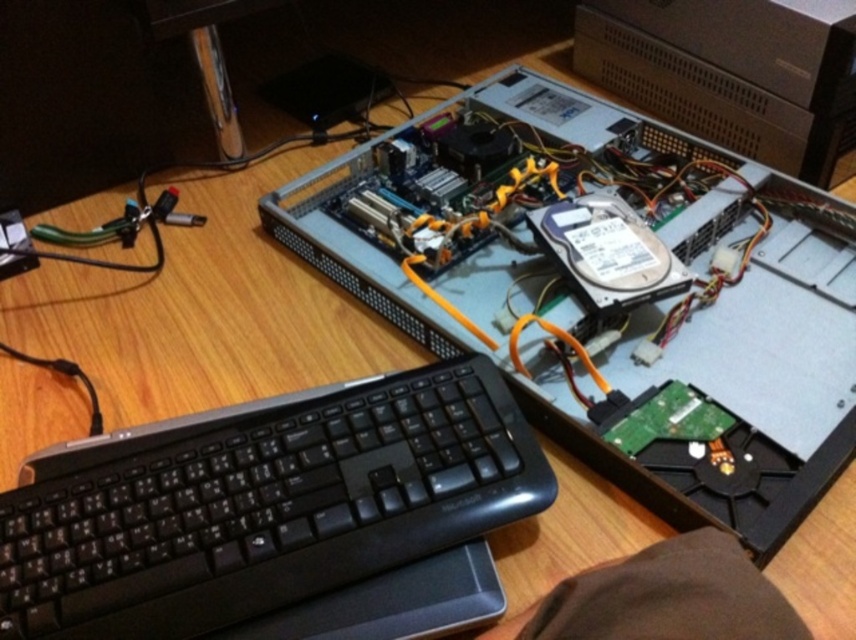
What do you see at coordinates (277, 516) in the screenshot? The height and width of the screenshot is (640, 856). I see `black plastic keyboard at lower left` at bounding box center [277, 516].

Which is in front, point (503, 499) or point (730, 54)?

Point (503, 499)

Locate an element on the screen. Image resolution: width=856 pixels, height=640 pixels. black plastic keyboard at lower left is located at coordinates (277, 516).

The height and width of the screenshot is (640, 856). What are the coordinates of `black plastic keyboard at lower left` in the screenshot? It's located at (277, 516).

Is silver metallic computer at center to the left of black plastic keyboard at lower left from the viewer's perspective?

In fact, silver metallic computer at center is to the right of black plastic keyboard at lower left.

In the scene shown: Which is more to the right, silver metallic computer at center or black plastic keyboard at lower left?

From the viewer's perspective, silver metallic computer at center appears more on the right side.

Which is in front, point (740, 486) or point (46, 465)?

Point (740, 486) is in front.

Image resolution: width=856 pixels, height=640 pixels. I want to click on silver metallic computer at center, so click(610, 292).

Does silver metallic computer at center have a lesser width compared to sleek silver desktop at upper center?

No.

Is silver metallic computer at center to the left of sleek silver desktop at upper center from the viewer's perspective?

Indeed, silver metallic computer at center is positioned on the left side of sleek silver desktop at upper center.

This screenshot has width=856, height=640. What do you see at coordinates (610, 292) in the screenshot?
I see `silver metallic computer at center` at bounding box center [610, 292].

At what (x,y) coordinates should I click in order to perform the action: click on silver metallic computer at center. Please return your answer as a coordinate pair (x, y). Image resolution: width=856 pixels, height=640 pixels. Looking at the image, I should click on (610, 292).